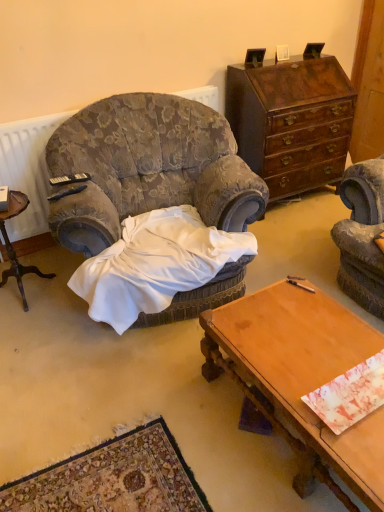
Find the location of a particular element. This screenshot has height=512, width=384. vacant point above marbled paper at center (from a real-world perspective) is located at coordinates (352, 388).